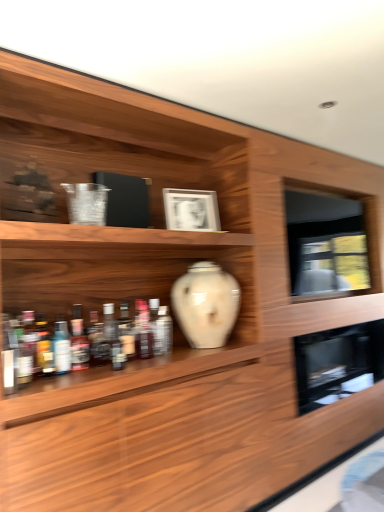
This screenshot has height=512, width=384. I want to click on matte black bottle at center, which is counted as the seventh bottle, starting from the back, so (98, 341).

At what (x,y) coordinates should I click in order to perform the action: click on black glass fireplace at lower right. Please return your answer as a coordinate pair (x, y). This screenshot has height=512, width=384. Looking at the image, I should click on (337, 362).

At what (x,y) coordinates should I click in order to perform the action: click on translucent glass bottle at center, the second bottle when ordered from back to front. Please return your answer as a coordinate pair (x, y). This screenshot has width=384, height=512. Looking at the image, I should click on [113, 337].

Where is `white matte picture frame at upper center`? Image resolution: width=384 pixels, height=512 pixels. white matte picture frame at upper center is located at coordinates (191, 210).

What is the approximate height of translucent glass bottle at lower left, the eighth bottle when ordered from back to front?

It is 8.87 inches.

At what (x,y) coordinates should I click in order to perform the action: click on matte black bottle at center, placed as the fifth bottle when sorted from front to back. Please return your answer as a coordinate pair (x, y). Looking at the image, I should click on (98, 341).

Is translucent glass bottles at left, which is the second bottle from front to back, turned away from translucent glass bottle at lower left, the eighth bottle when ordered from back to front?

No, translucent glass bottle at lower left, the eighth bottle when ordered from back to front, is not at the back of translucent glass bottles at left, which is the second bottle from front to back.

Is translucent glass bottle at lower left, the eighth bottle when ordered from back to front, completely or partially inside translucent glass bottles at left, which is the second bottle from front to back?

No.

From a real-world perspective, is translucent glass bottles at left, which ranks as the tenth bottle in back-to-front order, below translucent glass bottle at lower left, the eighth bottle when ordered from back to front?

No, from a real-world perspective, translucent glass bottles at left, which ranks as the tenth bottle in back-to-front order, is not below translucent glass bottle at lower left, the eighth bottle when ordered from back to front.

Visually, is translucent glass bottles at left, which ranks as the tenth bottle in back-to-front order, positioned to the left or to the right of translucent glass bottle at lower left, the eighth bottle when ordered from back to front?

translucent glass bottles at left, which ranks as the tenth bottle in back-to-front order, is to the left of translucent glass bottle at lower left, the eighth bottle when ordered from back to front.

Does white glossy vase at center appear on the left side of white matte picture frame at upper center?

In fact, white glossy vase at center is to the right of white matte picture frame at upper center.

Considering the relative sizes of white glossy vase at center and white matte picture frame at upper center in the image provided, is white glossy vase at center shorter than white matte picture frame at upper center?

No.

Where is `picture frame above the white glossy vase at center (from a real-world perspective)`? This screenshot has height=512, width=384. picture frame above the white glossy vase at center (from a real-world perspective) is located at coordinates (191, 210).

Which of these two, white glossy vase at center or white matte picture frame at upper center, is smaller?

With smaller size is white matte picture frame at upper center.

Between black glass fireplace at lower right and translucent plastic bottle at left, which is the 3th bottle in front-to-back order, which one appears on the right side from the viewer's perspective?

black glass fireplace at lower right.

From a real-world perspective, who is located lower, black glass fireplace at lower right or translucent plastic bottle at left, the ninth bottle when ordered from back to front?

black glass fireplace at lower right, from a real-world perspective.

Can you see black glass fireplace at lower right touching translucent plastic bottle at left, the ninth bottle when ordered from back to front?

No, black glass fireplace at lower right is not making contact with translucent plastic bottle at left, the ninth bottle when ordered from back to front.

In the scene shown: Can you confirm if translucent glass bottle at center, which appears as the 1th bottle when viewed from the back, is smaller than white glossy vase at center, placed as the third bottle when sorted from back to front?

Yes, translucent glass bottle at center, which appears as the 1th bottle when viewed from the back, is smaller than white glossy vase at center, placed as the third bottle when sorted from back to front.

In the scene shown: Can you confirm if translucent glass bottle at center, which appears as the 1th bottle when viewed from the back, is positioned to the right of white glossy vase at center, placed as the third bottle when sorted from back to front?

No.

From the image's perspective, is translucent glass bottle at center, which appears as the 1th bottle when viewed from the back, over white glossy vase at center, placed as the third bottle when sorted from back to front?

Yes, from the image's perspective, translucent glass bottle at center, which appears as the 1th bottle when viewed from the back, is on top of white glossy vase at center, placed as the third bottle when sorted from back to front.

From the picture: From a real-world perspective, which object stands above the other?

From a 3D spatial view, translucent glass bottle at center, which is counted as the 11th bottle, starting from the front, is above.

Which of these two, black glass fireplace at lower right or translucent glass bottle at center, which appears as the 1th bottle when viewed from the back, is smaller?

Smaller between the two is translucent glass bottle at center, which appears as the 1th bottle when viewed from the back.

Considering the sizes of black glass fireplace at lower right and translucent glass bottle at center, which is counted as the 11th bottle, starting from the front, in the image, is black glass fireplace at lower right wider or thinner than translucent glass bottle at center, which is counted as the 11th bottle, starting from the front,?

black glass fireplace at lower right is wider than translucent glass bottle at center, which is counted as the 11th bottle, starting from the front.

From the image's perspective, who appears lower, black glass fireplace at lower right or translucent glass bottle at center, which is counted as the 11th bottle, starting from the front?

black glass fireplace at lower right appears lower in the image.

Considering the positions of objects translucent glass bottle at left, which is counted as the 7th bottle, starting from the front, and translucent glass bottles at shelf center, which is the eighth bottle from front to back, in the image provided, who is behind, translucent glass bottle at left, which is counted as the 7th bottle, starting from the front, or translucent glass bottles at shelf center, which is the eighth bottle from front to back,?

translucent glass bottles at shelf center, which is the eighth bottle from front to back.

Between translucent glass bottle at left, which is counted as the 7th bottle, starting from the front, and translucent glass bottles at shelf center, which is the eighth bottle from front to back, which one has smaller width?

With smaller width is translucent glass bottle at left, which is counted as the 7th bottle, starting from the front.

Can you confirm if translucent glass bottle at left, which appears as the fifth bottle when viewed from the back, is shorter than translucent glass bottles at shelf center, which is the eighth bottle from front to back?

Yes, translucent glass bottle at left, which appears as the fifth bottle when viewed from the back, is shorter than translucent glass bottles at shelf center, which is the eighth bottle from front to back.

Could you measure the distance between translucent glass bottle at left, which appears as the fifth bottle when viewed from the back, and translucent glass bottles at shelf center, which is the eighth bottle from front to back?

translucent glass bottle at left, which appears as the fifth bottle when viewed from the back, is 13.53 inches away from translucent glass bottles at shelf center, which is the eighth bottle from front to back.

Consider the image. Which of these two, translucent glass bottle at center, which is counted as the 6th bottle, starting from the back, or translucent glass bottles at shelf center, the fourth bottle from the back, is bigger?

translucent glass bottles at shelf center, the fourth bottle from the back.

Measure the distance between translucent glass bottle at center, which is the sixth bottle from front to back, and translucent glass bottles at shelf center, which is the eighth bottle from front to back.

A distance of 2.50 inches exists between translucent glass bottle at center, which is the sixth bottle from front to back, and translucent glass bottles at shelf center, which is the eighth bottle from front to back.

Locate an element on the screen. Image resolution: width=384 pixels, height=512 pixels. bottle that is the 2nd object located in front of the translucent glass bottles at shelf center, the fourth bottle from the back is located at coordinates (126, 331).

Which is farther, (x=123, y=347) or (x=141, y=302)?

The point (x=141, y=302) is behind.

From the translucent glass bottle at lower left, which is the 4th bottle from front to back, count 2nd bottles forward and point to it. Please provide its 2D coordinates.

[(30, 337)]

The height and width of the screenshot is (512, 384). Find the location of `picture frame lying on the left of white glossy vase at center`. picture frame lying on the left of white glossy vase at center is located at coordinates (191, 210).

Looking at the image, which one is located closer to matte black bottle at center, which is counted as the seventh bottle, starting from the back, translucent glass bottle at center, which is the sixth bottle from front to back, or translucent glass bottle at center, the second bottle when ordered from back to front?

Based on the image, translucent glass bottle at center, the second bottle when ordered from back to front, appears to be nearer to matte black bottle at center, which is counted as the seventh bottle, starting from the back.

When comparing their distances from black glass fireplace at lower right, does translucent glass bottle at left, which appears as the fifth bottle when viewed from the back, or translucent glass bottle at center, which is the sixth bottle from front to back, seem further?

translucent glass bottle at left, which appears as the fifth bottle when viewed from the back.

Consider the image. Based on their spatial positions, is white glossy vase at center, placed as the third bottle when sorted from back to front, or translucent glass bottle at left, the eleventh bottle in the back-to-front sequence, closer to translucent glass bottle at center, the tenth bottle positioned from the front?

white glossy vase at center, placed as the third bottle when sorted from back to front, lies closer to translucent glass bottle at center, the tenth bottle positioned from the front, than the other object.

Based on their spatial positions, is white glossy vase at center or translucent glass bottle at center, which is the sixth bottle from front to back, closer to translucent glass bottle at center, which appears as the 1th bottle when viewed from the back?

Among the two, translucent glass bottle at center, which is the sixth bottle from front to back, is located nearer to translucent glass bottle at center, which appears as the 1th bottle when viewed from the back.

From the image, which object appears to be nearer to translucent glass bottle at center, the second bottle when ordered from back to front, black glass fireplace at lower right or white matte picture frame at upper center?

white matte picture frame at upper center.

When comparing their distances from translucent plastic bottle at left, which is the 3th bottle in front-to-back order, does black glass fireplace at lower right or translucent glass bottle at left, which is counted as the 7th bottle, starting from the front, seem further?

black glass fireplace at lower right lies further to translucent plastic bottle at left, which is the 3th bottle in front-to-back order, than the other object.

Considering their positions, is translucent glass bottle at lower left, the eighth bottle when ordered from back to front, positioned further to white glossy vase at center than translucent glass bottle at center, which is the sixth bottle from front to back?

translucent glass bottle at lower left, the eighth bottle when ordered from back to front, lies further to white glossy vase at center than the other object.

When comparing their distances from matte black bottle at center, which is counted as the seventh bottle, starting from the back, does translucent glass bottle at center, the tenth bottle positioned from the front, or translucent glass bottle at center, which is the sixth bottle from front to back, seem closer?

The object closer to matte black bottle at center, which is counted as the seventh bottle, starting from the back, is translucent glass bottle at center, the tenth bottle positioned from the front.

Where is `vase between white matte picture frame at upper center and translucent glass bottle at center, the second bottle when ordered from back to front, vertically`? vase between white matte picture frame at upper center and translucent glass bottle at center, the second bottle when ordered from back to front, vertically is located at coordinates (206, 304).

The image size is (384, 512). I want to click on vase located between translucent glass bottle at center, which is counted as the 11th bottle, starting from the front, and black glass fireplace at lower right in the left-right direction, so tap(206, 304).

Identify the location of bottle between translucent glass bottle at center, the tenth bottle positioned from the front, and translucent glass bottles at shelf center, the fourth bottle from the back, from left to right. (126, 331).

I want to click on vase between white matte picture frame at upper center and translucent glass bottles at shelf center, which is the eighth bottle from front to back, vertically, so click(x=206, y=304).